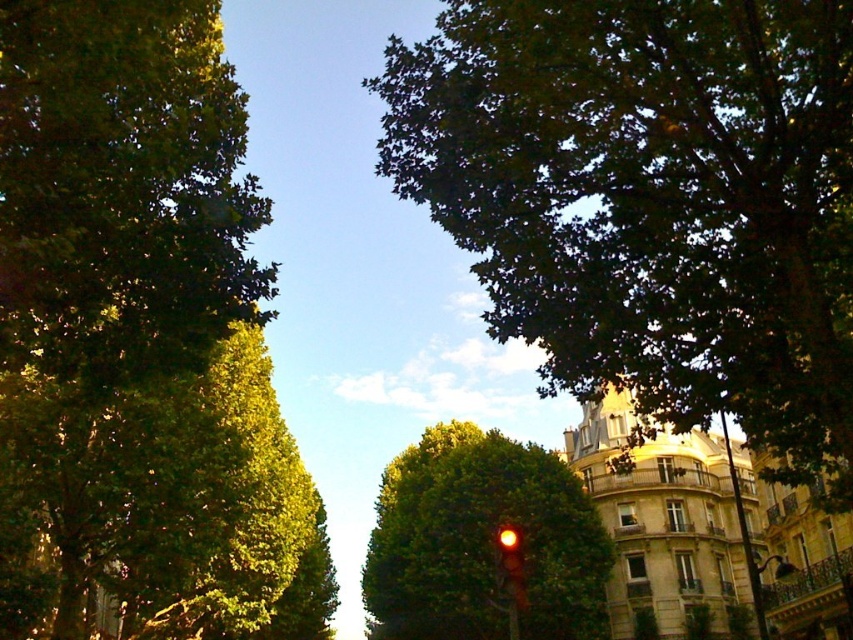
Question: Where is green leafy tree at upper left located in relation to red glass traffic light at center in the image?

Choices:
 (A) below
 (B) above

Answer: (B)

Question: Does green leafy tree at upper right have a smaller size compared to red glass traffic light at center?

Choices:
 (A) no
 (B) yes

Answer: (A)

Question: Based on their relative distances, which object is farther from the green leafy tree at upper right?

Choices:
 (A) green leafy tree at center
 (B) red glass traffic light at center
 (C) green leafy tree at upper left

Answer: (A)

Question: Where is green leafy tree at upper right located in relation to red glass traffic light at center in the image?

Choices:
 (A) below
 (B) above

Answer: (B)

Question: Which of the following is the closest to the observer?

Choices:
 (A) red glass traffic light at center
 (B) green leafy tree at upper right
 (C) green leafy tree at upper left

Answer: (C)

Question: Which of the following is the farthest from the observer?

Choices:
 (A) green leafy tree at upper right
 (B) red glass traffic light at center
 (C) green leafy tree at upper left
 (D) green leafy tree at center

Answer: (B)